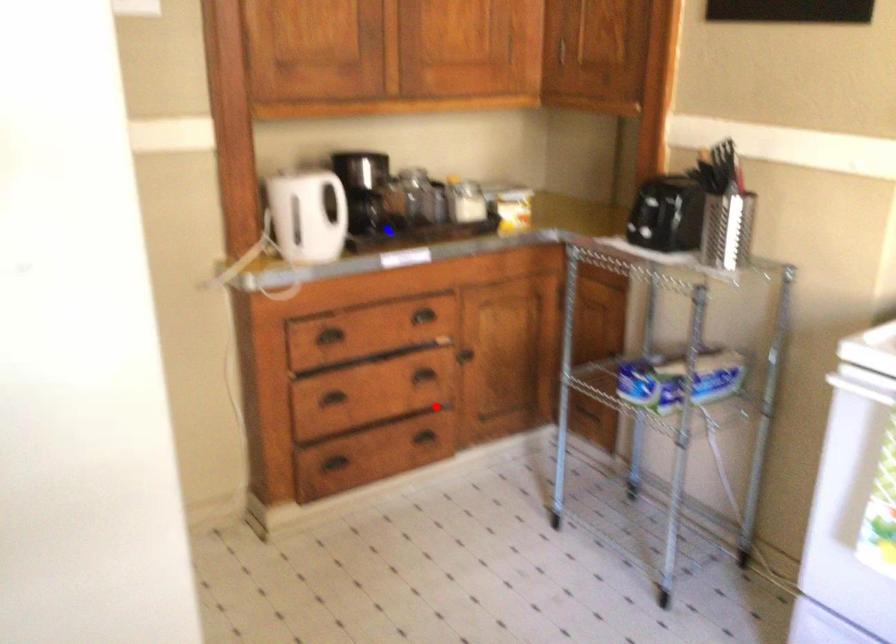
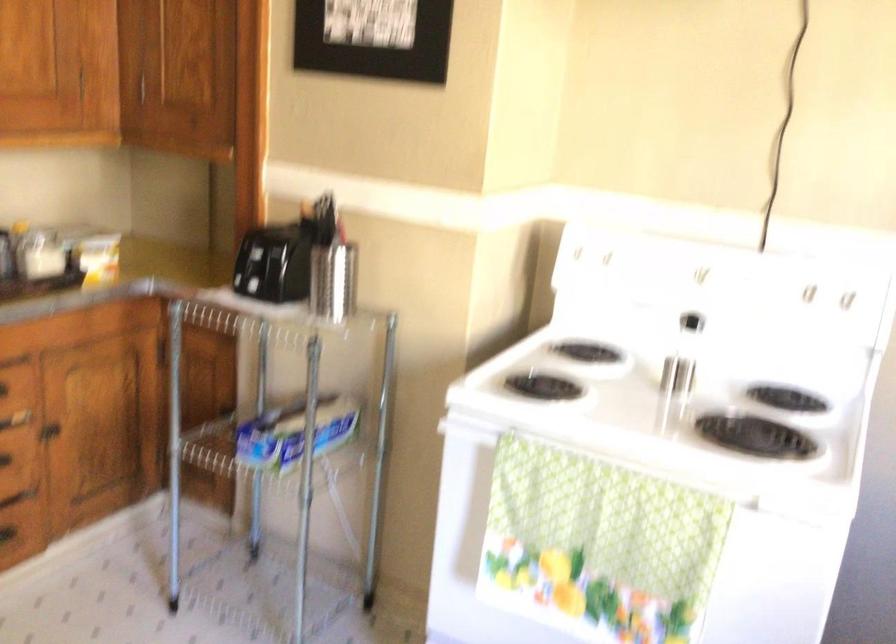
Question: I am providing you with two images of the same scene from different viewpoints. In image1, a red point is highlighted. Considering the same 3D point in image2, which of the following is correct?

Choices:
 (A) It is closer
 (B) It is farther

Answer: (A)